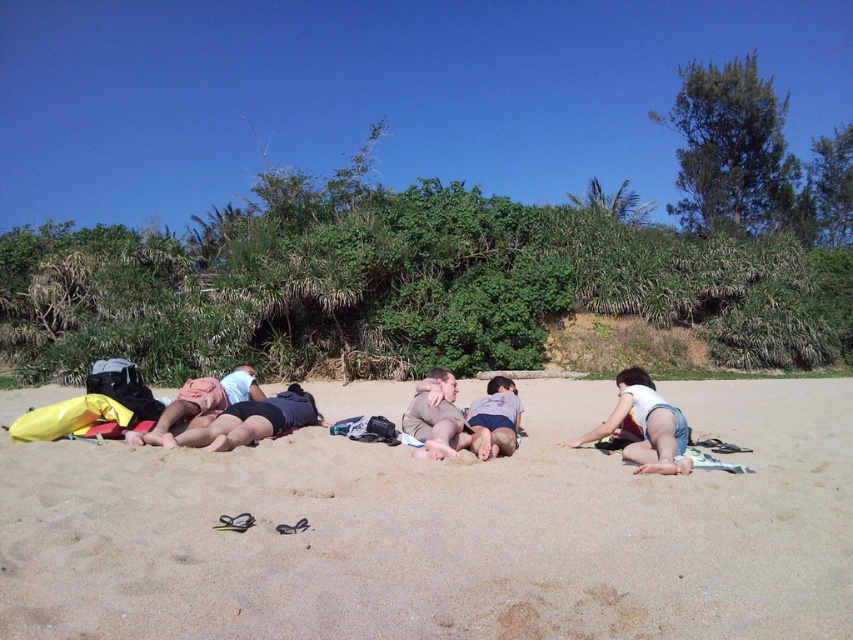
You are a photographer planning to take a photo of the denim shorts at lower right and the light gray fabric shorts at center. Based on their positions, which one will appear larger in the photo?

The denim shorts at lower right will appear larger in the photo because it is much taller than the light gray fabric shorts at center.

You are a photographer trying to capture a photo of the matte pink shorts at center without including the denim shorts at lower right in the frame. Based on their positions, is this possible?

The denim shorts at lower right is in front of matte pink shorts at center, so it would block the view. Therefore, it is not possible to capture the matte pink shorts at center without including the denim shorts at lower right in the frame.

You are a beachgoer trying to decide where to place your beach towel. You see two pairs of shorts, the denim shorts at lower right and the matte pink shorts at center. Which pair has a wider leg opening?

The matte pink shorts at center has a greater width compared to denim shorts at lower right, so the matte pink shorts at center has a wider leg opening.